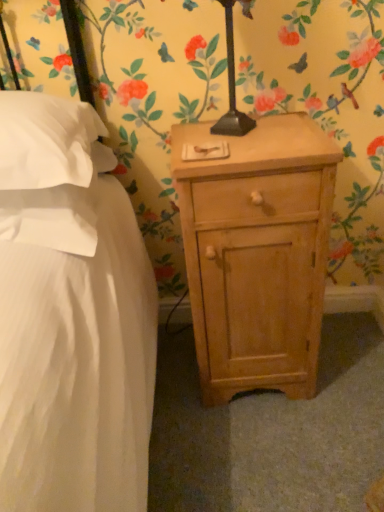
You are a GUI agent. You are given a task and a screenshot of the screen. Output one action in this format:
    pyautogui.click(x=<x>, y=<y>)
    Task: Click on the light wood nightstand at lower right
    This screenshot has width=384, height=512.
    Given the screenshot: What is the action you would take?
    pyautogui.click(x=257, y=254)

Locate an element on the screen. white soft pillow at left, which is the 2th pillow from top to bottom is located at coordinates (57, 211).

From a real-world perspective, which object stands above the other?

Answer: From a 3D spatial view, white soft pillow at left, which is the 2th pillow from top to bottom, is above.

Considering the positions of objects white soft pillow at left, which is the 2th pillow from top to bottom, and light wood nightstand at lower right in the image provided, who is behind, white soft pillow at left, which is the 2th pillow from top to bottom, or light wood nightstand at lower right?

Positioned behind is light wood nightstand at lower right.

Between white soft pillow at left, which is the 2th pillow from top to bottom, and light wood nightstand at lower right, which one has less height?

white soft pillow at left, which is the 2th pillow from top to bottom, is shorter.

Considering the sizes of objects white soft pillow at left, the first pillow in the top-to-bottom sequence, and white soft pillow at left, which is the 2th pillow from top to bottom, in the image provided, who is thinner, white soft pillow at left, the first pillow in the top-to-bottom sequence, or white soft pillow at left, which is the 2th pillow from top to bottom,?

white soft pillow at left, which is the 2th pillow from top to bottom.

Which object is further away from the camera, white soft pillow at left, placed as the 2th pillow when sorted from bottom to top, or white soft pillow at left, positioned as the 1th pillow in bottom-to-top order?

white soft pillow at left, positioned as the 1th pillow in bottom-to-top order, is further from the camera.

Would you say white soft pillow at left, the first pillow in the top-to-bottom sequence, contains white soft pillow at left, positioned as the 1th pillow in bottom-to-top order?

No, white soft pillow at left, the first pillow in the top-to-bottom sequence, does not contain white soft pillow at left, positioned as the 1th pillow in bottom-to-top order.

Is point (21, 152) closer or farther from the camera than point (6, 202)?

Point (21, 152).

Could you tell me if white soft pillow at left, positioned as the 1th pillow in bottom-to-top order, is turned towards white soft pillow at left, placed as the 2th pillow when sorted from bottom to top?

No.

From the image's perspective, which one is positioned lower, white soft pillow at left, positioned as the 1th pillow in bottom-to-top order, or white soft pillow at left, placed as the 2th pillow when sorted from bottom to top?

From the image's view, white soft pillow at left, positioned as the 1th pillow in bottom-to-top order, is below.

Is light wood nightstand at lower right shorter than white soft pillow at left, the first pillow in the top-to-bottom sequence?

In fact, light wood nightstand at lower right may be taller than white soft pillow at left, the first pillow in the top-to-bottom sequence.

Is the surface of light wood nightstand at lower right in direct contact with white soft pillow at left, placed as the 2th pillow when sorted from bottom to top?

They are not placed beside each other.

Which is correct: light wood nightstand at lower right is inside white soft pillow at left, the first pillow in the top-to-bottom sequence, or outside of it?

light wood nightstand at lower right is not inside white soft pillow at left, the first pillow in the top-to-bottom sequence, it's outside.

Considering the points (245, 166) and (29, 164), which point is behind, point (245, 166) or point (29, 164)?

The point (245, 166) is farther.

Which object is closer to the camera, white soft pillow at left, the first pillow in the top-to-bottom sequence, or light wood nightstand at lower right?

white soft pillow at left, the first pillow in the top-to-bottom sequence, is more forward.

From a real-world perspective, which pillow is the 2nd one above the light wood nightstand at lower right? Please provide its 2D coordinates.

[(45, 141)]

Is white soft pillow at left, the first pillow in the top-to-bottom sequence, in contact with light wood nightstand at lower right?

There is a gap between white soft pillow at left, the first pillow in the top-to-bottom sequence, and light wood nightstand at lower right.

Does white soft pillow at left, placed as the 2th pillow when sorted from bottom to top, contain light wood nightstand at lower right?

No.

Is point (260, 359) farther from viewer compared to point (32, 189)?

Yes, point (260, 359) is behind point (32, 189).

From a real-world perspective, starting from the light wood nightstand at lower right, which pillow is the 1st one vertically above it? Please provide its 2D coordinates.

[(57, 211)]

From a real-world perspective, is light wood nightstand at lower right physically located above or below white soft pillow at left, positioned as the 1th pillow in bottom-to-top order?

Clearly, from a real-world perspective, light wood nightstand at lower right is below white soft pillow at left, positioned as the 1th pillow in bottom-to-top order.

What's the angular difference between light wood nightstand at lower right and white soft pillow at left, which is the 2th pillow from top to bottom,'s facing directions?

The angular difference between light wood nightstand at lower right and white soft pillow at left, which is the 2th pillow from top to bottom, is 2.19 degrees.

You are a GUI agent. You are given a task and a screenshot of the screen. Output one action in this format:
    pyautogui.click(x=<x>, y=<y>)
    Task: Click on the 1st pillow in front of the light wood nightstand at lower right, counting from the anchor's position
    The image size is (384, 512).
    Given the screenshot: What is the action you would take?
    pyautogui.click(x=57, y=211)

Where is `pillow behind the white soft pillow at left, placed as the 2th pillow when sorted from bottom to top`? pillow behind the white soft pillow at left, placed as the 2th pillow when sorted from bottom to top is located at coordinates (57, 211).

Looking at this image, from the image, which object appears to be farther from white soft pillow at left, which is the 2th pillow from top to bottom, white soft pillow at left, placed as the 2th pillow when sorted from bottom to top, or light wood nightstand at lower right?

Result: The object further to white soft pillow at left, which is the 2th pillow from top to bottom, is light wood nightstand at lower right.

Based on the photo, from the image, which object appears to be nearer to white soft pillow at left, the first pillow in the top-to-bottom sequence, light wood nightstand at lower right or white soft pillow at left, positioned as the 1th pillow in bottom-to-top order?

The object closer to white soft pillow at left, the first pillow in the top-to-bottom sequence, is white soft pillow at left, positioned as the 1th pillow in bottom-to-top order.

Which object lies nearer to the anchor point light wood nightstand at lower right, white soft pillow at left, which is the 2th pillow from top to bottom, or white soft pillow at left, the first pillow in the top-to-bottom sequence?

The object closer to light wood nightstand at lower right is white soft pillow at left, which is the 2th pillow from top to bottom.

From the image, which object appears to be nearer to white soft pillow at left, positioned as the 1th pillow in bottom-to-top order, light wood nightstand at lower right or white soft pillow at left, the first pillow in the top-to-bottom sequence?

The object closer to white soft pillow at left, positioned as the 1th pillow in bottom-to-top order, is white soft pillow at left, the first pillow in the top-to-bottom sequence.

Which object lies further to the anchor point light wood nightstand at lower right, white soft pillow at left, placed as the 2th pillow when sorted from bottom to top, or white soft pillow at left, which is the 2th pillow from top to bottom?

white soft pillow at left, placed as the 2th pillow when sorted from bottom to top.

From the image, which object appears to be nearer to white soft pillow at left, placed as the 2th pillow when sorted from bottom to top, white soft pillow at left, which is the 2th pillow from top to bottom, or light wood nightstand at lower right?

Among the two, white soft pillow at left, which is the 2th pillow from top to bottom, is located nearer to white soft pillow at left, placed as the 2th pillow when sorted from bottom to top.

Locate an element on the screen. The height and width of the screenshot is (512, 384). pillow located between white soft pillow at left, positioned as the 1th pillow in bottom-to-top order, and light wood nightstand at lower right in the left-right direction is located at coordinates (45, 141).